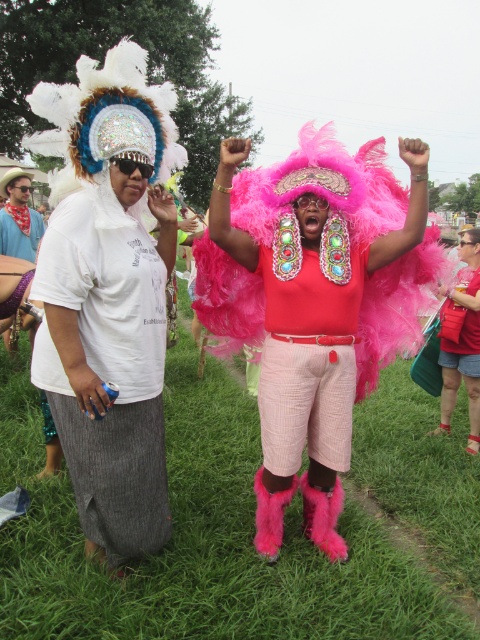
Question: From the image, what is the correct spatial relationship of white textured skirt at left in relation to matte pink feather boa at center?

Choices:
 (A) left
 (B) right

Answer: (A)

Question: Based on their relative distances, which object is farther from the brushed metal water at bottle left?

Choices:
 (A) matte pink feather boa at center
 (B) pink feather boa at center

Answer: (A)

Question: Which point is farther to the camera?

Choices:
 (A) (450, 365)
 (B) (278, 528)

Answer: (A)

Question: Which of the following is the farthest from the observer?

Choices:
 (A) brushed metal water at bottle left
 (B) green grass at center
 (C) fuzzy pink boa at center

Answer: (A)

Question: Can you confirm if fuzzy pink boa at center is positioned to the right of brushed metal water at bottle left?

Choices:
 (A) yes
 (B) no

Answer: (A)

Question: Is fuzzy pink boa at center to the left of brushed metal water at bottle left from the viewer's perspective?

Choices:
 (A) yes
 (B) no

Answer: (B)